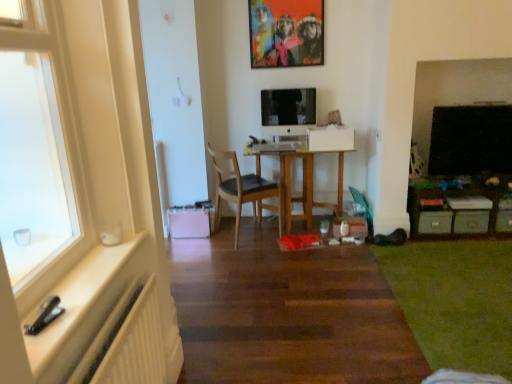
Locate an element on the screen. free space in front of wooden chair at center is located at coordinates (252, 255).